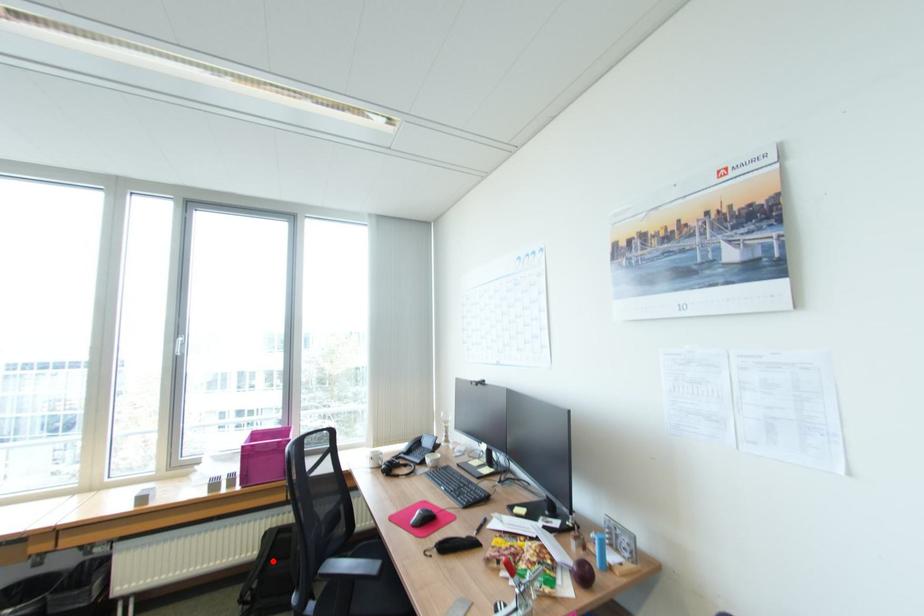
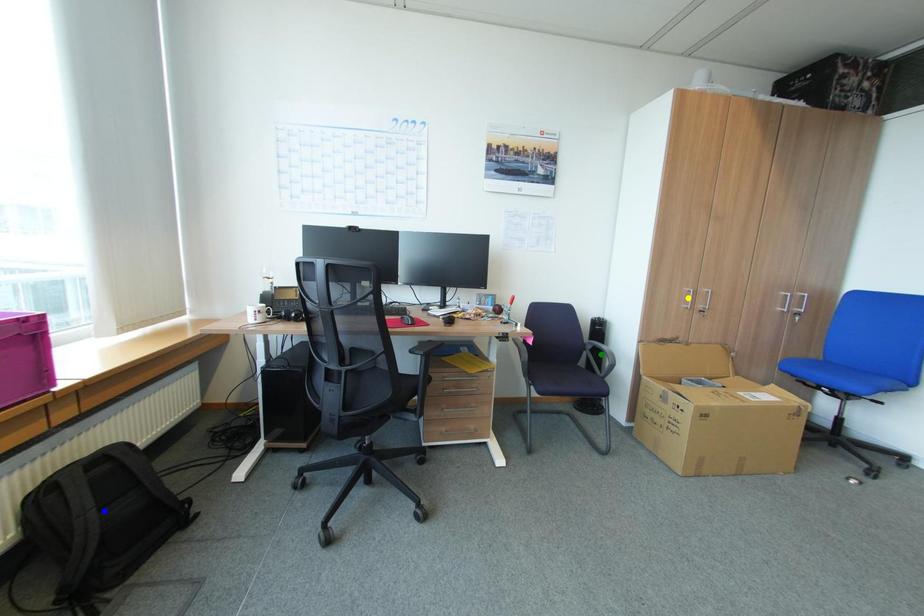
Question: I am providing you with two images of the same scene from different viewpoints. A red point is marked on the first image. You are given multiple points on the second image. Can you choose the point in image 2 that corresponds to the point in image 1?

Choices:
 (A) yellow point
 (B) blue point
 (C) green point

Answer: (B)